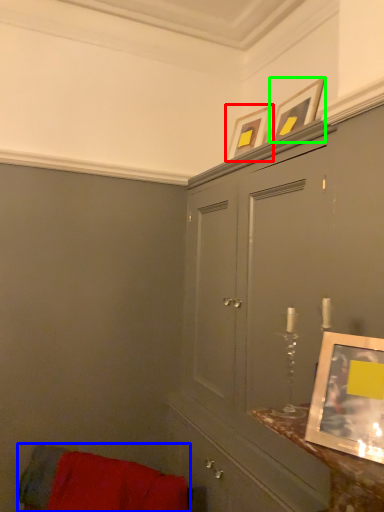
Question: Estimate the real-world distances between objects in this image. Which object is farther from picture frame (highlighted by a red box), furniture (highlighted by a blue box) or picture frame (highlighted by a green box)?

Choices:
 (A) furniture
 (B) picture frame

Answer: (A)